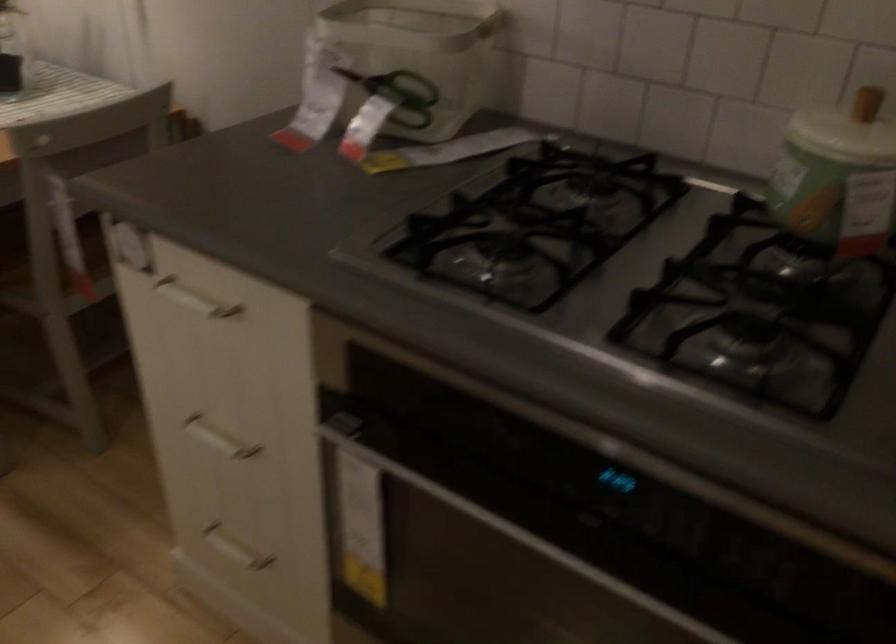
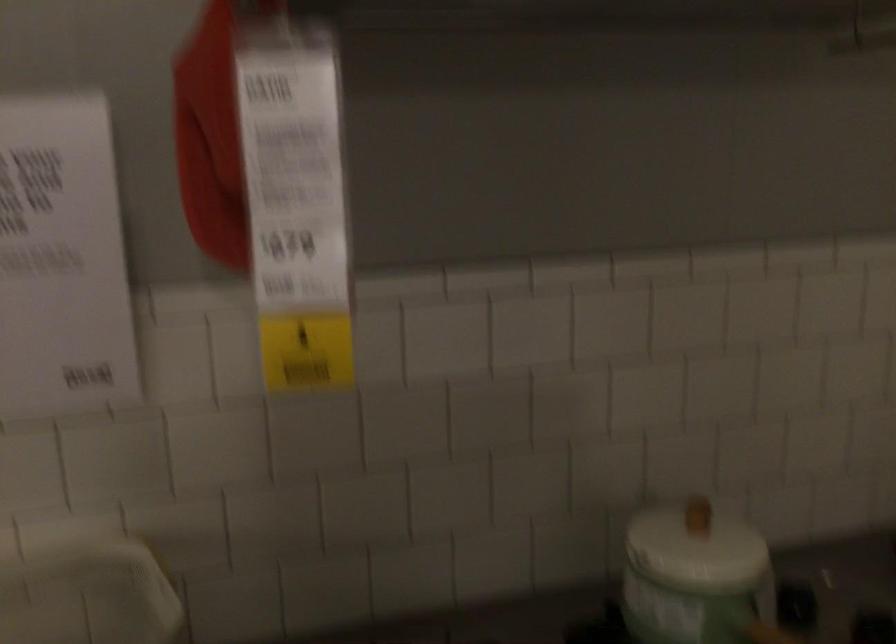
Question: Based on the continuous images, in which direction is the camera rotating? Reply with the corresponding letter.

Choices:
 (A) Left
 (B) Right
 (C) Up
 (D) Down

Answer: (B)